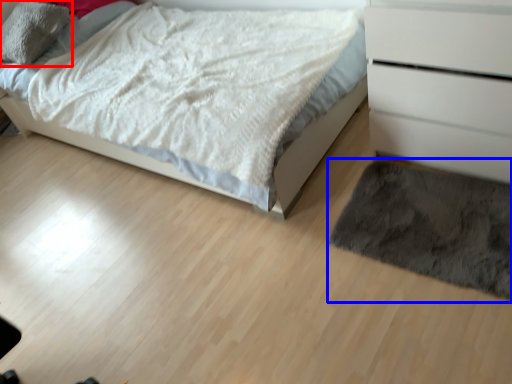
Question: Which point is closer to the camera, pillow (highlighted by a red box) or mat (highlighted by a blue box)?

Choices:
 (A) pillow
 (B) mat

Answer: (B)